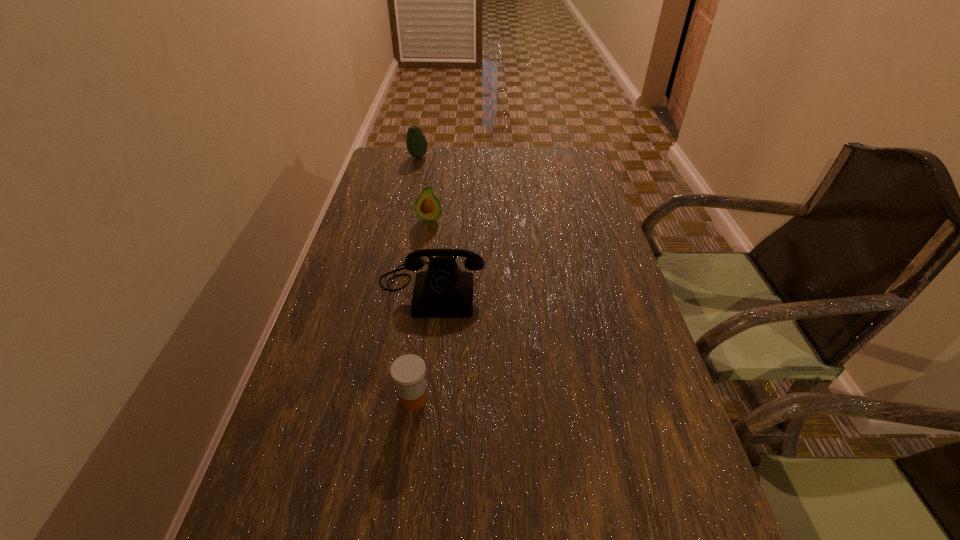
Image resolution: width=960 pixels, height=540 pixels. What are the coordinates of `the farther avocado` in the screenshot? It's located at (416, 143).

I want to click on the nearer avocado, so click(427, 207).

Find the location of `the second nearest object`. the second nearest object is located at coordinates (442, 291).

Image resolution: width=960 pixels, height=540 pixels. In order to click on the nearest object in this screenshot , I will do `click(408, 371)`.

Locate an element on the screen. free location located 0.360m on the right of the farther avocado is located at coordinates (528, 157).

Locate an element on the screen. free space located on the cut side of the second farthest object is located at coordinates (416, 307).

Where is `free point located 0.390m on the front face of the telephone`? The height and width of the screenshot is (540, 960). free point located 0.390m on the front face of the telephone is located at coordinates (406, 494).

Locate an element on the screen. This screenshot has width=960, height=540. vacant position located 0.240m on the label of the medicine is located at coordinates (554, 400).

This screenshot has height=540, width=960. In order to click on object that is at the far edge in this screenshot , I will do `click(416, 143)`.

Where is `avocado that is at the left edge`? avocado that is at the left edge is located at coordinates (416, 143).